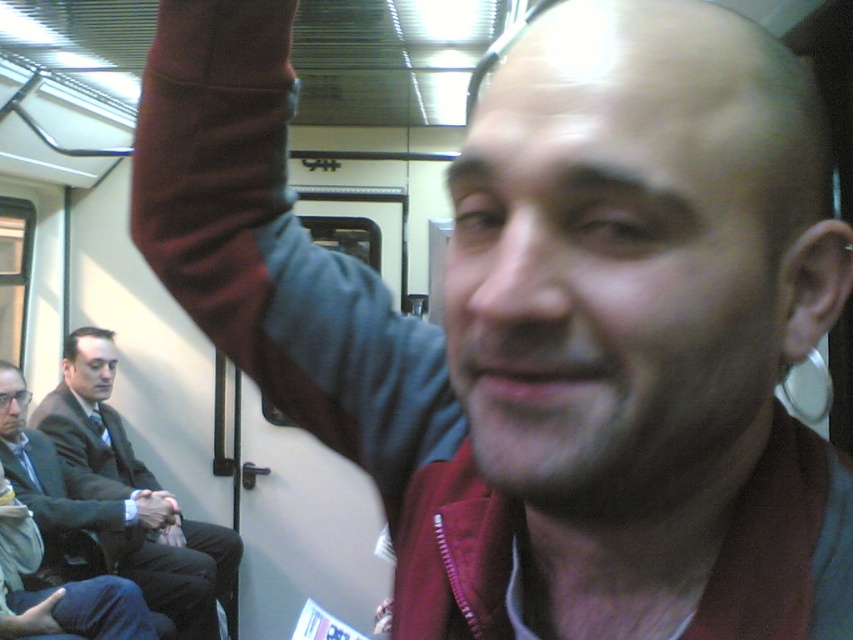
Question: Which object appears closest to the camera in this image?

Choices:
 (A) dark gray suit at left
 (B) dark suit at left

Answer: (A)

Question: Does bald head at center appear on the left side of maroon fabric arm at upper left?

Choices:
 (A) yes
 (B) no

Answer: (B)

Question: Does bald head at center appear over black suit coat at left?

Choices:
 (A) yes
 (B) no

Answer: (A)

Question: Which object appears farthest from the camera in this image?

Choices:
 (A) dark gray suit at left
 (B) bald head at center
 (C) maroon fabric arm at upper left
 (D) matte black glasses at left

Answer: (A)

Question: Which object is farther from the camera taking this photo?

Choices:
 (A) dark gray suit at left
 (B) maroon fabric arm at upper left
 (C) dark suit at left
 (D) black suit coat at left

Answer: (C)

Question: Does black suit coat at left appear over matte black glasses at left?

Choices:
 (A) yes
 (B) no

Answer: (B)